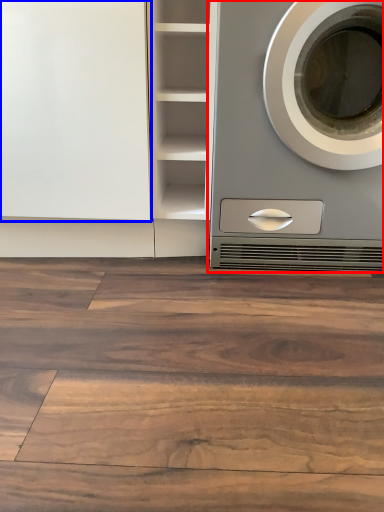
Question: Which of the following is the farthest to the observer, washing machine (highlighted by a red box) or glass door (highlighted by a blue box)?

Choices:
 (A) washing machine
 (B) glass door

Answer: (B)